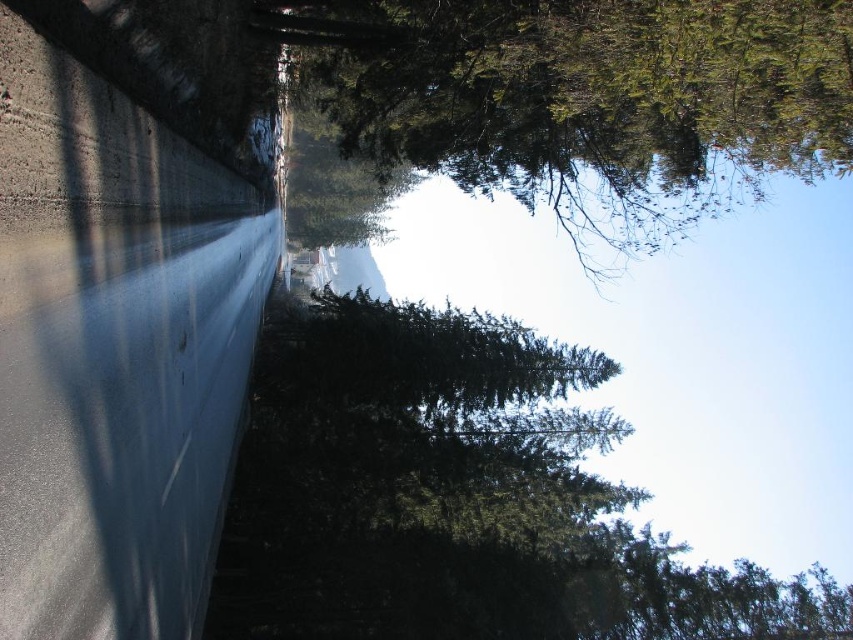
Which of these two, green matte tree at center or green matte tree at upper center, stands taller?

Standing taller between the two is green matte tree at center.

Is the position of green matte tree at center less distant than that of green matte tree at upper center?

No.

Is point (439, 609) farther from camera compared to point (642, 120)?

Yes.

Identify the location of green matte tree at center. This screenshot has height=640, width=853. (456, 497).